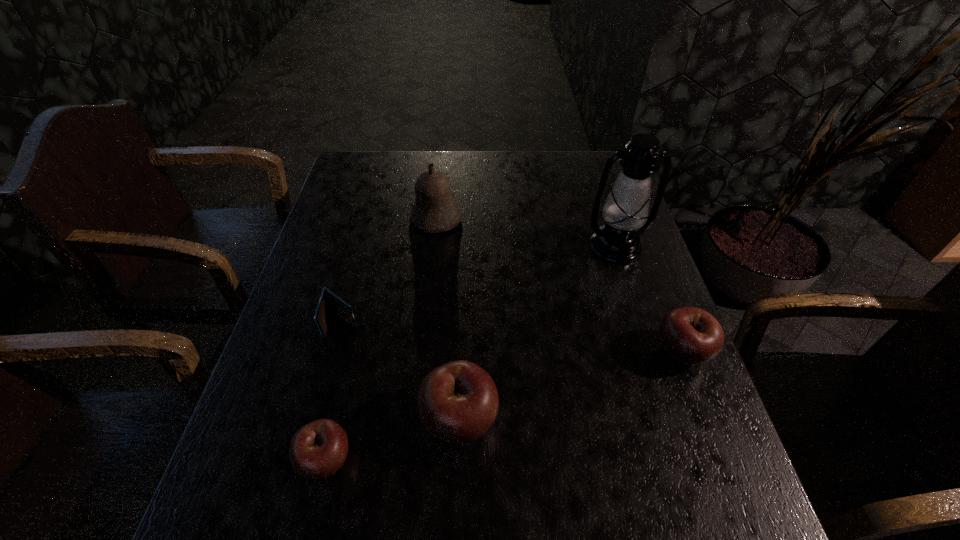
At what (x,y) coordinates should I click in order to perform the action: click on vacant area located 0.270m on the side of the farthest apple with the unique marking. Please return your answer as a coordinate pair (x, y). Image resolution: width=960 pixels, height=540 pixels. Looking at the image, I should click on (533, 352).

Find the location of `free location located 0.060m on the side of the farthest apple with the unique marking`. free location located 0.060m on the side of the farthest apple with the unique marking is located at coordinates (627, 352).

Locate an element on the screen. This screenshot has width=960, height=540. vacant space positioned 0.310m on the side of the farthest apple with the unique marking is located at coordinates (515, 352).

At what (x,y) coordinates should I click in order to perform the action: click on free space located 0.150m on the exterior surface of the wallet. Please return your answer as a coordinate pair (x, y). Looking at the image, I should click on [x=322, y=400].

Locate an element on the screen. The width and height of the screenshot is (960, 540). blank area located on the right of the second tallest object is located at coordinates (583, 219).

You are a GUI agent. You are given a task and a screenshot of the screen. Output one action in this format:
    pyautogui.click(x=<x>, y=<y>)
    Task: Click on the blank space located on the back of the tallest object
    
    Given the screenshot: What is the action you would take?
    pyautogui.click(x=590, y=168)

This screenshot has width=960, height=540. Identify the location of apple that is at the left edge. [x=317, y=450].

Identify the location of wallet that is positioned at the left edge. (328, 302).

Where is `apple present at the right edge`? Image resolution: width=960 pixels, height=540 pixels. apple present at the right edge is located at coordinates (691, 336).

Locate an element on the screen. Image resolution: width=960 pixels, height=540 pixels. oil lamp that is at the right edge is located at coordinates coord(626,208).